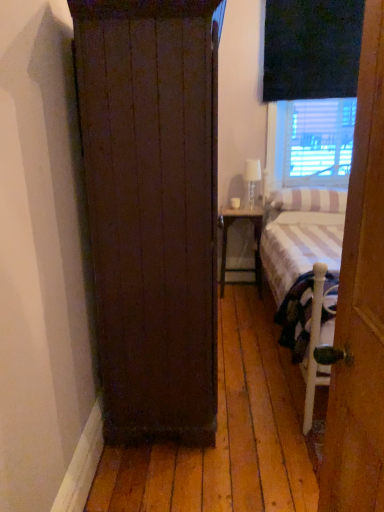
Image resolution: width=384 pixels, height=512 pixels. What do you see at coordinates (309, 199) in the screenshot?
I see `white striped pillow at right` at bounding box center [309, 199].

The width and height of the screenshot is (384, 512). What are the coordinates of `matte white wood nightstand at center` in the screenshot? It's located at (254, 240).

From a real-world perspective, who is located lower, white striped pillow at right or dark wood cupboard at left?

white striped pillow at right is physically lower.

In terms of size, does white striped pillow at right appear bigger or smaller than dark wood cupboard at left?

Considering their sizes, white striped pillow at right takes up less space than dark wood cupboard at left.

Between white striped pillow at right and dark wood cupboard at left, which one is positioned behind?

white striped pillow at right.

Which is less distant, (375, 499) or (259, 231)?

Point (375, 499).

Considering the sizes of objects wooden door at right and matte white wood nightstand at center in the image provided, who is wider, wooden door at right or matte white wood nightstand at center?

Wider between the two is matte white wood nightstand at center.

Which is more to the right, wooden door at right or matte white wood nightstand at center?

Positioned to the right is matte white wood nightstand at center.

How distant is wooden door at right from matte white wood nightstand at center?

wooden door at right and matte white wood nightstand at center are 2.48 meters apart from each other.

Relative to white striped pillow at right, is dark wood cupboard at left in front or behind?

Visually, dark wood cupboard at left is located in front of white striped pillow at right.

Is white striped pillow at right a part of dark wood cupboard at left?

Actually, white striped pillow at right is outside dark wood cupboard at left.

Is dark wood cupboard at left bigger than white striped pillow at right?

Indeed, dark wood cupboard at left has a larger size compared to white striped pillow at right.

Considering the relative sizes of matte white wood nightstand at center and clear glass lamp at upper right in the image provided, is matte white wood nightstand at center smaller than clear glass lamp at upper right?

No.

Are matte white wood nightstand at center and clear glass lamp at upper right far apart?

That's not correct — matte white wood nightstand at center is a little close to clear glass lamp at upper right.

Between matte white wood nightstand at center and clear glass lamp at upper right, which one is positioned behind?

Positioned behind is clear glass lamp at upper right.

Can you confirm if matte white wood nightstand at center is thinner than clear glass lamp at upper right?

No.

Which point is more forward, (253, 223) or (274, 207)?

Positioned in front is point (274, 207).

Where is `pillow located above the matte white wood nightstand at center (from the image's perspective)`? This screenshot has height=512, width=384. pillow located above the matte white wood nightstand at center (from the image's perspective) is located at coordinates (309, 199).

Is matte white wood nightstand at center in front of white striped pillow at right?

No.

From the image's perspective, which object appears higher, white striped pillow at right or clear glass lamp at upper right?

clear glass lamp at upper right.

Looking at this image, is white striped pillow at right positioned before clear glass lamp at upper right?

Yes, white striped pillow at right is closer to the viewer.

Is point (289, 210) positioned before point (252, 195)?

That is True.

The height and width of the screenshot is (512, 384). In order to click on lamp that appears above the white striped pillow at right (from the image's perspective) in this screenshot , I will do `click(251, 180)`.

Considering the sizes of dark wood cupboard at left and white striped fabric bed at right in the image, is dark wood cupboard at left bigger or smaller than white striped fabric bed at right?

Considering their sizes, dark wood cupboard at left takes up less space than white striped fabric bed at right.

From a real-world perspective, is dark wood cupboard at left physically located above or below white striped fabric bed at right?

Clearly, from a real-world perspective, dark wood cupboard at left is above white striped fabric bed at right.

Could you tell me if dark wood cupboard at left is turned towards white striped fabric bed at right?

Yes, dark wood cupboard at left is aimed at white striped fabric bed at right.

Which object is wider, dark wood cupboard at left or white striped fabric bed at right?

With larger width is white striped fabric bed at right.

In the image, there is a white striped pillow at right. Identify the location of cupboard below it (from the image's perspective). The image size is (384, 512). (152, 209).

In the image, there is a wooden door at right. At what (x,y) coordinates should I click in order to perform the action: click on nightstand below it (from a real-world perspective). Please return your answer as a coordinate pair (x, y). The image size is (384, 512). Looking at the image, I should click on (254, 240).

When comparing their distances from clear glass lamp at upper right, does white striped pillow at right or white striped fabric bed at right seem closer?

white striped pillow at right.

Estimate the real-world distances between objects in this image. Which object is closer to white striped pillow at right, white striped fabric bed at right or matte white wood nightstand at center?

matte white wood nightstand at center lies closer to white striped pillow at right than the other object.

From the picture: Which object lies nearer to the anchor point white striped fabric bed at right, clear glass lamp at upper right or dark wood cupboard at left?

Among the two, dark wood cupboard at left is located nearer to white striped fabric bed at right.

Based on their spatial positions, is white striped pillow at right or dark wood cupboard at left closer to wooden door at right?

The object closer to wooden door at right is dark wood cupboard at left.

When comparing their distances from clear glass lamp at upper right, does white striped pillow at right or matte white wood nightstand at center seem closer?

matte white wood nightstand at center lies closer to clear glass lamp at upper right than the other object.

Looking at this image, from the image, which object appears to be nearer to dark wood cupboard at left, wooden door at right or white striped pillow at right?

The object closer to dark wood cupboard at left is wooden door at right.

When comparing their distances from white striped fabric bed at right, does dark wood cupboard at left or wooden door at right seem further?

The object further to white striped fabric bed at right is wooden door at right.

Looking at the image, which one is located further to clear glass lamp at upper right, white striped pillow at right or dark wood cupboard at left?

dark wood cupboard at left is positioned further to the anchor clear glass lamp at upper right.

Locate an element on the screen. This screenshot has height=512, width=384. nightstand located between white striped fabric bed at right and clear glass lamp at upper right in the depth direction is located at coordinates (254, 240).

Locate an element on the screen. This screenshot has width=384, height=512. cupboard between wooden door at right and matte white wood nightstand at center along the z-axis is located at coordinates (152, 209).

Locate an element on the screen. This screenshot has width=384, height=512. bed between dark wood cupboard at left and clear glass lamp at upper right along the z-axis is located at coordinates (306, 272).

Image resolution: width=384 pixels, height=512 pixels. I want to click on pillow between clear glass lamp at upper right and matte white wood nightstand at center vertically, so click(x=309, y=199).